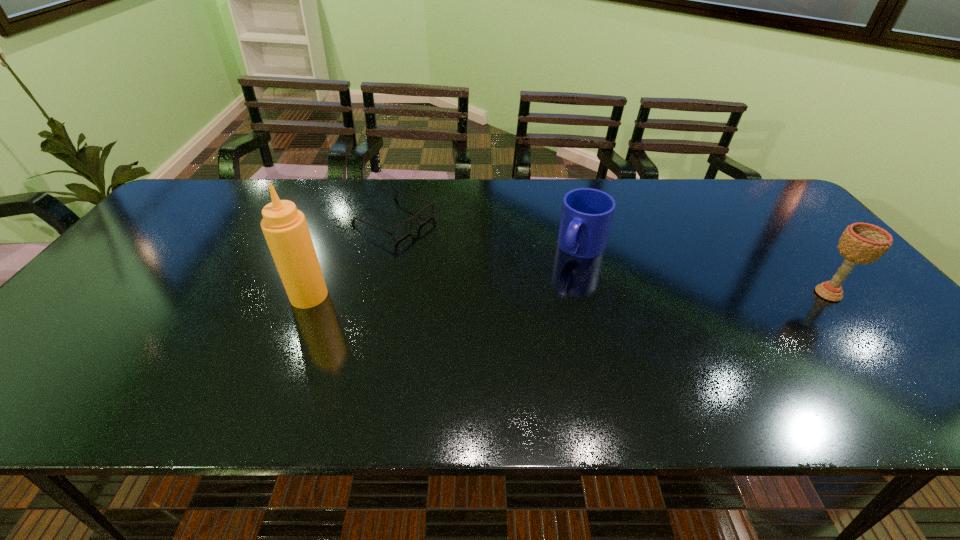
I want to click on the tallest object, so click(285, 228).

Image resolution: width=960 pixels, height=540 pixels. What are the coordinates of `the third shortest object` in the screenshot? It's located at (861, 243).

Identify the location of chalice. (861, 243).

Locate an element on the screen. This screenshot has width=960, height=540. the third tallest object is located at coordinates (587, 213).

Find the location of a particular element. the second object from right to left is located at coordinates (587, 213).

Where is `the shortest object`? Image resolution: width=960 pixels, height=540 pixels. the shortest object is located at coordinates (392, 233).

Locate an element on the screen. The height and width of the screenshot is (540, 960). vacant region located 0.060m on the left of the tallest object is located at coordinates (267, 296).

Where is `vacant space located on the left of the chalice`? vacant space located on the left of the chalice is located at coordinates (722, 294).

Identify the location of free spot located 0.280m on the side with the handle of the third object from left to right. (526, 333).

At what (x,y) coordinates should I click in order to perform the action: click on vacant point located on the side with the handle of the third object from left to right. Please return your answer as a coordinate pair (x, y). This screenshot has width=960, height=540. Looking at the image, I should click on (502, 367).